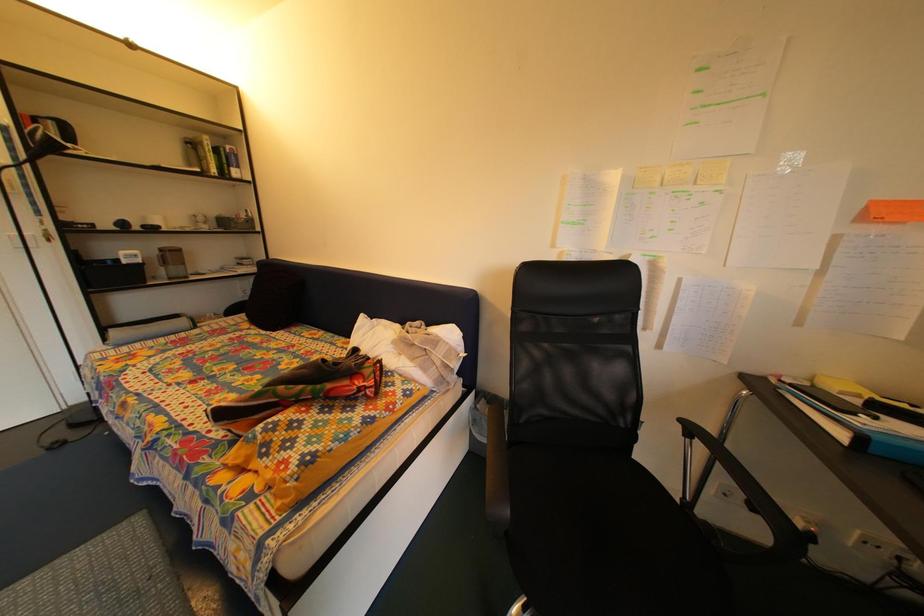
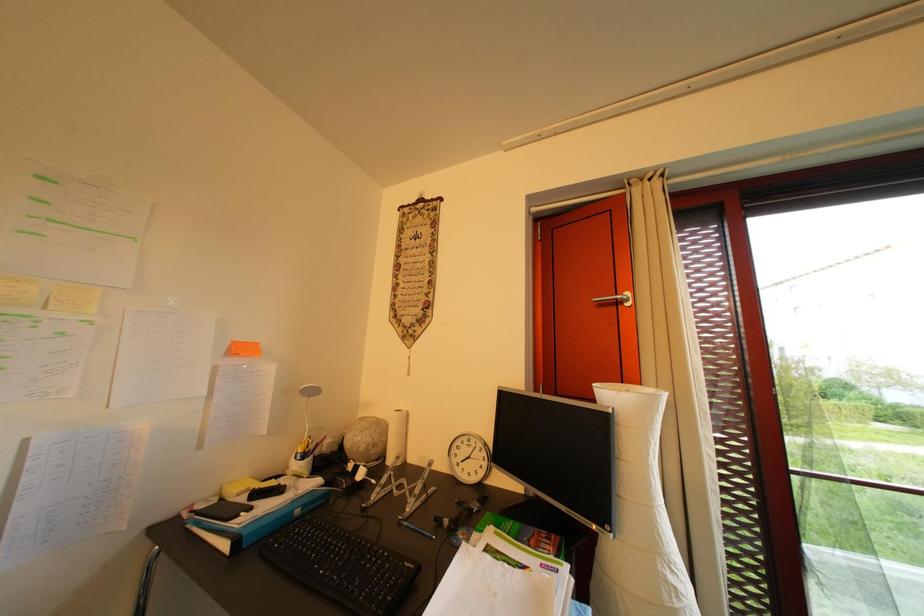
Question: Based on the continuous images, in which direction is the camera rotating? Reply with the corresponding letter.

Choices:
 (A) Left
 (B) Right
 (C) Up
 (D) Down

Answer: (B)